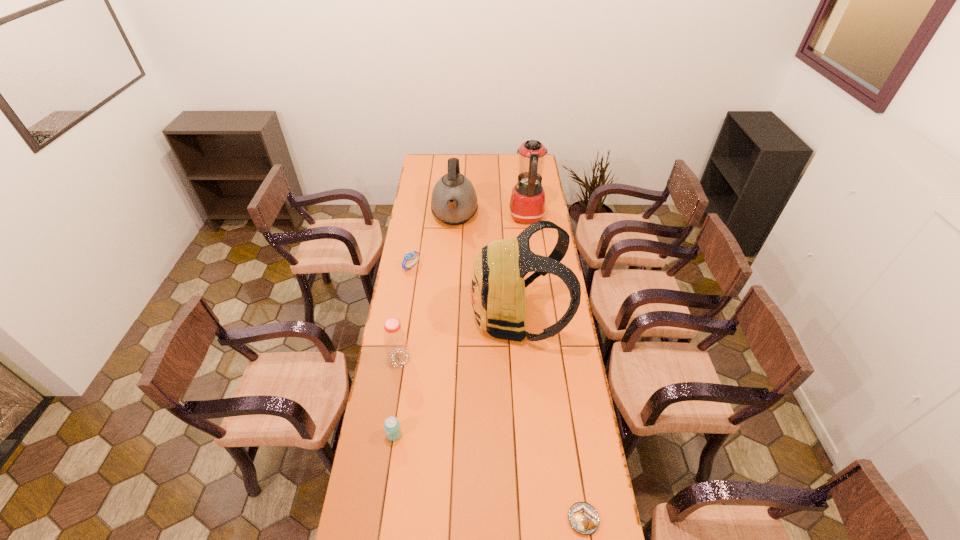
At what (x,y) coordinates should I click in order to perform the action: click on vacant space located on the controls of the food processor. Please return your answer as a coordinate pair (x, y). Looking at the image, I should click on 442,217.

Where is `vacant area located on the controls of the food processor`? vacant area located on the controls of the food processor is located at coordinates (467, 217).

Where is `blank area located on the controls of the food processor`? This screenshot has height=540, width=960. blank area located on the controls of the food processor is located at coordinates (465, 217).

Where is `free space located on the front-facing side of the backpack`? The width and height of the screenshot is (960, 540). free space located on the front-facing side of the backpack is located at coordinates (415, 317).

Where is `free location located on the front-facing side of the backpack`? The width and height of the screenshot is (960, 540). free location located on the front-facing side of the backpack is located at coordinates (405, 317).

Identify the location of vacant space located 0.060m on the front-facing side of the backpack. (457, 317).

I want to click on free space located at the spout of the kettle, so click(450, 282).

Locate an element on the screen. This screenshot has height=540, width=960. vacant region located on the right of the bottle is located at coordinates (431, 358).

At what (x,y) coordinates should I click in order to perform the action: click on vacant space situated on the back of the second nearest object. Please return your answer as a coordinate pair (x, y). This screenshot has height=540, width=960. Looking at the image, I should click on click(406, 352).

Find the location of a particular element. Image resolution: width=960 pixels, height=540 pixels. vacant space located 0.180m on the back of the second shortest object is located at coordinates (417, 235).